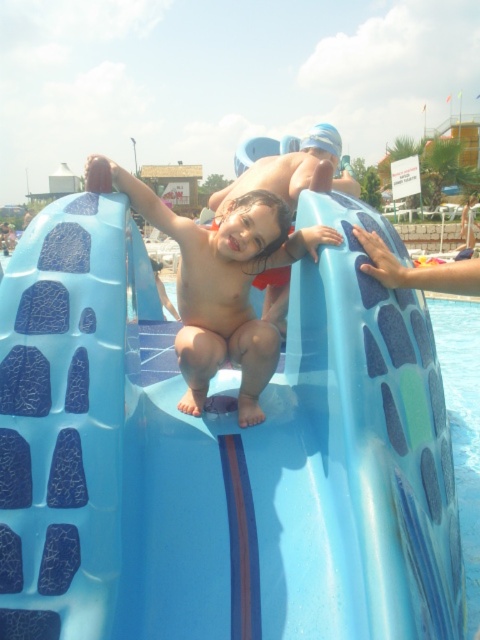
Describe the element at coordinates (218, 452) in the screenshot. This screenshot has width=480, height=640. I see `blue rubber slide at center` at that location.

Who is more forward, (32, 301) or (252, 356)?

Point (32, 301) is more forward.

Locate an element on the screen. The height and width of the screenshot is (640, 480). blue rubber slide at center is located at coordinates (218, 452).

Between point (229, 259) and point (443, 352), which one is positioned in front?

Point (229, 259)

Is matte blue slide at center below blue glossy water at lower right?

No, matte blue slide at center is not below blue glossy water at lower right.

Between point (222, 292) and point (454, 356), which one is positioned in front?

Point (222, 292) is more forward.

Where is `matte blue slide at center`? This screenshot has height=640, width=480. matte blue slide at center is located at coordinates (220, 282).

Based on the photo, does blue rubber slide at center have a lesser width compared to blue glossy water at lower right?

Indeed, blue rubber slide at center has a lesser width compared to blue glossy water at lower right.

Is blue rubber slide at center above blue glossy water at lower right?

Incorrect, blue rubber slide at center is not positioned above blue glossy water at lower right.

Identify the location of blue rubber slide at center. pyautogui.click(x=218, y=452).

In order to click on blue rubber slide at center in this screenshot , I will do tap(218, 452).